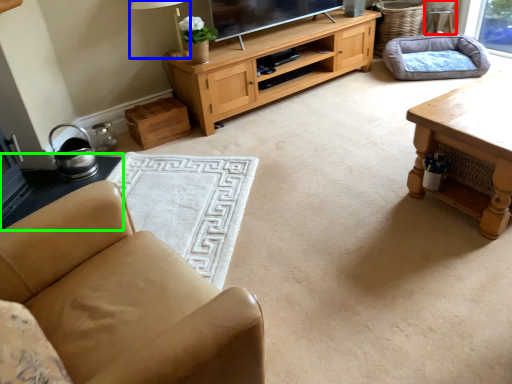
Question: Which is farther away from armchair (highlighted by a red box)? lamp (highlighted by a blue box) or side table (highlighted by a green box)?

Choices:
 (A) lamp
 (B) side table

Answer: (B)